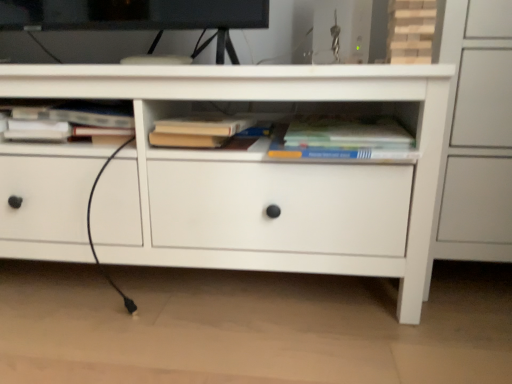
Measure the distance between hardcover book at center, which appears as the 2th book when viewed from the left, and camera.

A distance of 34.14 inches exists between hardcover book at center, which appears as the 2th book when viewed from the left, and camera.

What is the approximate width of white matte chest of drawers at center?

18.52 inches.

Measure the distance between white matte chest of drawers at center and camera.

31.40 inches.

Image resolution: width=512 pixels, height=384 pixels. Find the location of `hardcover book at upper left, which appears as the third book when viewed from the right`. hardcover book at upper left, which appears as the third book when viewed from the right is located at coordinates (70, 121).

The width and height of the screenshot is (512, 384). Describe the element at coordinates (70, 121) in the screenshot. I see `hardcover book at upper left, the first book positioned from the left` at that location.

Find the location of a particular element. This screenshot has width=512, height=384. hardcover book at center, the second book viewed from the right is located at coordinates (210, 131).

From a real-world perspective, is hardcover book at center, the 1th book in the right-to-left sequence, under white matte chest of drawers at center?

No, from a real-world perspective, hardcover book at center, the 1th book in the right-to-left sequence, is not beneath white matte chest of drawers at center.

Which point is more distant from viewer, (304, 157) or (335, 192)?

Positioned behind is point (335, 192).

Who is bigger, hardcover book at center, arranged as the third book when viewed from the left, or white matte chest of drawers at center?

Bigger between the two is white matte chest of drawers at center.

Looking at this image, is hardcover book at center, the 1th book in the right-to-left sequence, positioned with its back to white matte chest of drawers at center?

Yes.

Is point (321, 149) closer or farther from the camera than point (103, 116)?

Point (321, 149).

Would you say hardcover book at center, the 1th book in the right-to-left sequence, is to the left or to the right of hardcover book at upper left, the first book positioned from the left, in the picture?

hardcover book at center, the 1th book in the right-to-left sequence, is to the right of hardcover book at upper left, the first book positioned from the left.

Considering the relative sizes of hardcover book at center, arranged as the third book when viewed from the left, and hardcover book at upper left, which appears as the third book when viewed from the right, in the image provided, is hardcover book at center, arranged as the third book when viewed from the left, smaller than hardcover book at upper left, which appears as the third book when viewed from the right,?

Yes, hardcover book at center, arranged as the third book when viewed from the left, is smaller than hardcover book at upper left, which appears as the third book when viewed from the right.

Is hardcover book at center, arranged as the third book when viewed from the left, placed right next to hardcover book at upper left, the first book positioned from the left?

No, hardcover book at center, arranged as the third book when viewed from the left, is not making contact with hardcover book at upper left, the first book positioned from the left.

The image size is (512, 384). I want to click on book that is the 3rd one when counting backward from the white matte chest of drawers at center, so click(70, 121).

Between white matte chest of drawers at center and hardcover book at upper left, the first book positioned from the left, which one has more height?

Standing taller between the two is white matte chest of drawers at center.

From the image's perspective, is white matte chest of drawers at center located above hardcover book at upper left, the first book positioned from the left?

No.

This screenshot has width=512, height=384. What are the coordinates of `chest of drawers on the left of hardcover book at center, the 1th book in the right-to-left sequence` in the screenshot? It's located at (270, 172).

Does white matte chest of drawers at center turn towards hardcover book at center, arranged as the third book when viewed from the left?

Yes, white matte chest of drawers at center faces towards hardcover book at center, arranged as the third book when viewed from the left.

Who is bigger, white matte chest of drawers at center or hardcover book at center, the 1th book in the right-to-left sequence?

Bigger between the two is white matte chest of drawers at center.

Between white matte chest of drawers at center and hardcover book at center, the 1th book in the right-to-left sequence, which one appears on the right side from the viewer's perspective?

hardcover book at center, the 1th book in the right-to-left sequence, is more to the right.

Can you confirm if hardcover book at center, which appears as the 2th book when viewed from the left, is shorter than hardcover book at center, arranged as the third book when viewed from the left?

No.

Is hardcover book at center, the 1th book in the right-to-left sequence, inside hardcover book at center, which appears as the 2th book when viewed from the left?

No, hardcover book at center, which appears as the 2th book when viewed from the left, does not contain hardcover book at center, the 1th book in the right-to-left sequence.

From the image's perspective, between hardcover book at center, which appears as the 2th book when viewed from the left, and hardcover book at center, the 1th book in the right-to-left sequence, which one is located above?

hardcover book at center, which appears as the 2th book when viewed from the left, from the image's perspective.

Is hardcover book at center, which appears as the 2th book when viewed from the left, next to hardcover book at center, arranged as the third book when viewed from the left?

No.

Consider the image. Is hardcover book at upper left, which appears as the third book when viewed from the right, surrounding hardcover book at center, the second book viewed from the right?

Definitely not — hardcover book at center, the second book viewed from the right, is not inside hardcover book at upper left, which appears as the third book when viewed from the right.

In terms of height, does hardcover book at upper left, which appears as the third book when viewed from the right, look taller or shorter compared to hardcover book at center, the second book viewed from the right?

Considering their sizes, hardcover book at upper left, which appears as the third book when viewed from the right, has more height than hardcover book at center, the second book viewed from the right.

Based on the photo, from a real-world perspective, which object rests below the other?

hardcover book at center, which appears as the 2th book when viewed from the left, is physically lower.

Consider the image. From the image's perspective, is hardcover book at upper left, the first book positioned from the left, above or below hardcover book at center, the second book viewed from the right?

From the image's perspective, hardcover book at upper left, the first book positioned from the left, appears above hardcover book at center, the second book viewed from the right.

Is hardcover book at center, which appears as the 2th book when viewed from the left, placed right next to white matte chest of drawers at center?

No, hardcover book at center, which appears as the 2th book when viewed from the left, is not making contact with white matte chest of drawers at center.

Visually, is hardcover book at center, the second book viewed from the right, positioned to the left or to the right of white matte chest of drawers at center?

In the image, hardcover book at center, the second book viewed from the right, appears on the right side of white matte chest of drawers at center.

From the image's perspective, is hardcover book at center, the second book viewed from the right, below white matte chest of drawers at center?

No, from the image's perspective, hardcover book at center, the second book viewed from the right, is not beneath white matte chest of drawers at center.

Considering the sizes of hardcover book at center, which appears as the 2th book when viewed from the left, and white matte chest of drawers at center in the image, is hardcover book at center, which appears as the 2th book when viewed from the left, bigger or smaller than white matte chest of drawers at center?

hardcover book at center, which appears as the 2th book when viewed from the left, is smaller than white matte chest of drawers at center.

At what (x,y) coordinates should I click in order to perform the action: click on the 2nd book counting from the right side of the white matte chest of drawers at center. Please return your answer as a coordinate pair (x, y). This screenshot has height=384, width=512. Looking at the image, I should click on (341, 138).

You are a GUI agent. You are given a task and a screenshot of the screen. Output one action in this format:
    pyautogui.click(x=<x>, y=<y>)
    Task: Click on the 2nd book behind the hardcover book at center, arranged as the third book when viewed from the left, starting your count from the anchor
    The width and height of the screenshot is (512, 384).
    Given the screenshot: What is the action you would take?
    pyautogui.click(x=70, y=121)

From the image, which object appears to be nearer to hardcover book at upper left, the first book positioned from the left, white matte chest of drawers at center or hardcover book at center, the second book viewed from the right?

The object closer to hardcover book at upper left, the first book positioned from the left, is hardcover book at center, the second book viewed from the right.

Estimate the real-world distances between objects in this image. Which object is closer to hardcover book at center, which appears as the 2th book when viewed from the left, hardcover book at center, arranged as the third book when viewed from the left, or hardcover book at upper left, which appears as the third book when viewed from the right?

hardcover book at center, arranged as the third book when viewed from the left, lies closer to hardcover book at center, which appears as the 2th book when viewed from the left, than the other object.

Looking at the image, which one is located further to hardcover book at center, the 1th book in the right-to-left sequence, hardcover book at center, the second book viewed from the right, or hardcover book at upper left, the first book positioned from the left?

hardcover book at upper left, the first book positioned from the left, is further to hardcover book at center, the 1th book in the right-to-left sequence.

Considering their positions, is hardcover book at center, which appears as the 2th book when viewed from the left, positioned further to white matte chest of drawers at center than hardcover book at center, the 1th book in the right-to-left sequence?

hardcover book at center, the 1th book in the right-to-left sequence, lies further to white matte chest of drawers at center than the other object.

When comparing their distances from hardcover book at center, the 1th book in the right-to-left sequence, does hardcover book at upper left, the first book positioned from the left, or hardcover book at center, the second book viewed from the right, seem further?

hardcover book at upper left, the first book positioned from the left, is positioned further to the anchor hardcover book at center, the 1th book in the right-to-left sequence.

When comparing their distances from hardcover book at center, which appears as the 2th book when viewed from the left, does hardcover book at upper left, which appears as the third book when viewed from the right, or white matte chest of drawers at center seem closer?

white matte chest of drawers at center.

Which object lies nearer to the anchor point hardcover book at center, which appears as the 2th book when viewed from the left, hardcover book at center, the 1th book in the right-to-left sequence, or white matte chest of drawers at center?

hardcover book at center, the 1th book in the right-to-left sequence, is closer to hardcover book at center, which appears as the 2th book when viewed from the left.

Which object lies further to the anchor point hardcover book at upper left, which appears as the third book when viewed from the right, hardcover book at center, the second book viewed from the right, or hardcover book at center, arranged as the third book when viewed from the left?

Based on the image, hardcover book at center, arranged as the third book when viewed from the left, appears to be further to hardcover book at upper left, which appears as the third book when viewed from the right.

The height and width of the screenshot is (384, 512). I want to click on chest of drawers between hardcover book at upper left, which appears as the third book when viewed from the right, and hardcover book at center, the second book viewed from the right, in the horizontal direction, so click(270, 172).

In order to click on book between hardcover book at upper left, the first book positioned from the left, and hardcover book at center, arranged as the third book when viewed from the left in this screenshot , I will do `click(210, 131)`.

Find the location of a particular element. The height and width of the screenshot is (384, 512). book between white matte chest of drawers at center and hardcover book at center, the 1th book in the right-to-left sequence, in the horizontal direction is located at coordinates (210, 131).

The image size is (512, 384). I want to click on chest of drawers between hardcover book at upper left, which appears as the third book when viewed from the right, and hardcover book at center, the 1th book in the right-to-left sequence, in the horizontal direction, so click(270, 172).